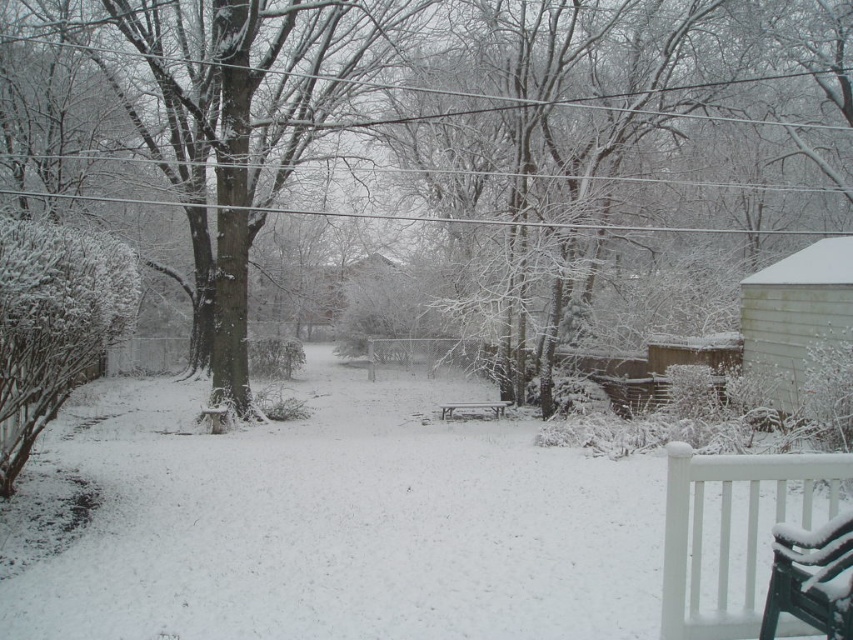
You are standing at the edge of the snow area and want to place a small snowman exactly at the center of the white fluffy snow at center. According to the coordinates provided, where should you position the snowman?

The white fluffy snow at center is located at point (341, 524), so you should position the snowman at those coordinates to place it exactly at the center of the white fluffy snow at center.

You are standing at the edge of the snowy backyard and see two points marked in the image. Which point is closer to you, point (676, 627) or point (473, 404)?

Point (676, 627) is in front of point (473, 404), so it is closer to you.